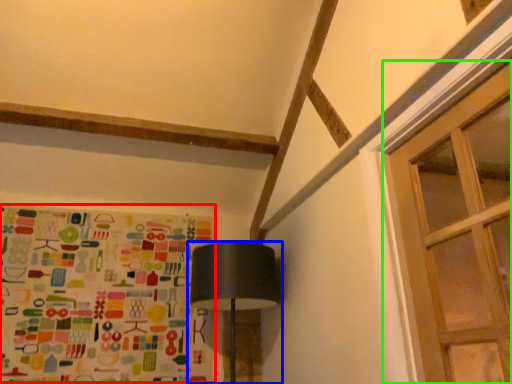
Question: Which object is the closest to the print (highlighted by a red box)? Choose among these: lamp (highlighted by a blue box) or window (highlighted by a green box).

Choices:
 (A) lamp
 (B) window

Answer: (A)